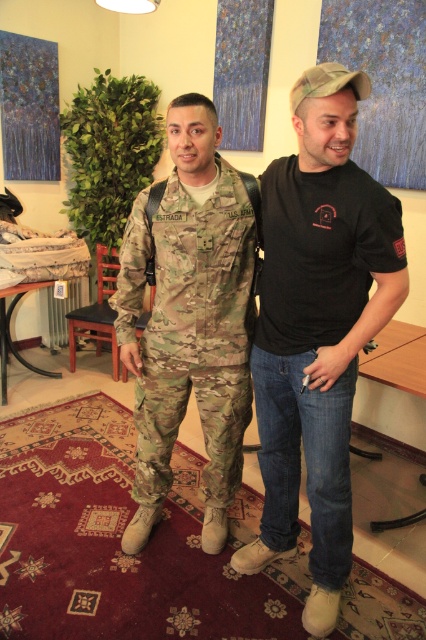
You are a delivery person who needs to hand over a package to the person in the U.S. Army uniform. You are currently standing at point (259, 380). Can you approach them without getting too close? The minimum safe distance is 1.5 meters.

The two individuals are 1.70 meters apart, so yes, you can approach the person in the U.S. Army uniform while maintaining the minimum safe distance of 1.5 meters since 1.70 meters is greater than 1.5 meters.